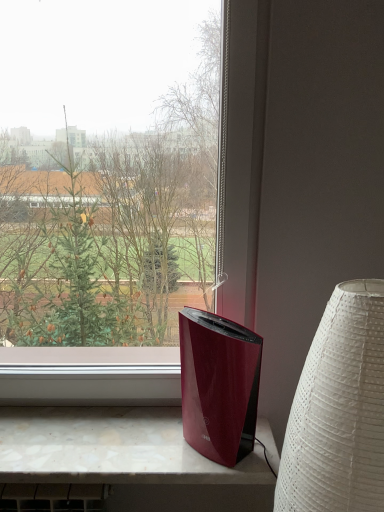
Question: Is white textured lampshade at right in front of or behind marble-like surface at lower center in the image?

Choices:
 (A) behind
 (B) front

Answer: (B)

Question: Considering the positions of white textured lampshade at right and marble-like surface at lower center in the image, is white textured lampshade at right taller or shorter than marble-like surface at lower center?

Choices:
 (A) tall
 (B) short

Answer: (A)

Question: Based on their sizes in the image, would you say white textured lampshade at right is bigger or smaller than marble-like surface at lower center?

Choices:
 (A) big
 (B) small

Answer: (A)

Question: From a real-world perspective, relative to white textured lampshade at right, is marble-like surface at lower center vertically above or below?

Choices:
 (A) above
 (B) below

Answer: (B)

Question: Considering the positions of point (276, 460) and point (334, 386), is point (276, 460) closer or farther from the camera than point (334, 386)?

Choices:
 (A) farther
 (B) closer

Answer: (A)

Question: Considering the relative positions of marble-like surface at lower center and white textured lampshade at right in the image provided, is marble-like surface at lower center to the left or to the right of white textured lampshade at right?

Choices:
 (A) right
 (B) left

Answer: (B)

Question: In terms of height, does marble-like surface at lower center look taller or shorter compared to white textured lampshade at right?

Choices:
 (A) short
 (B) tall

Answer: (A)